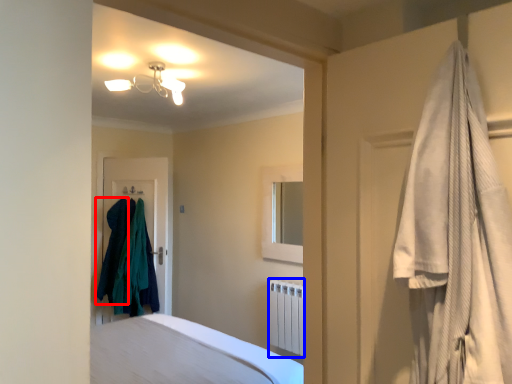
Question: Among these objects, which one is farthest to the camera, clothing (highlighted by a red box) or radiator (highlighted by a blue box)?

Choices:
 (A) clothing
 (B) radiator

Answer: (A)